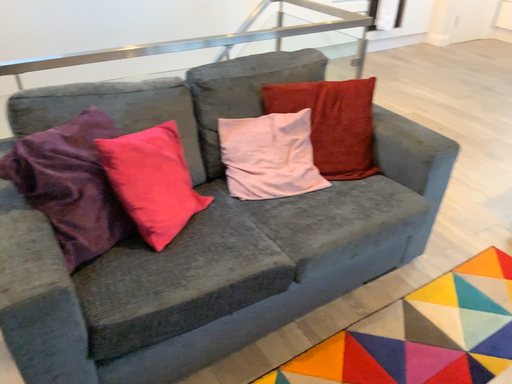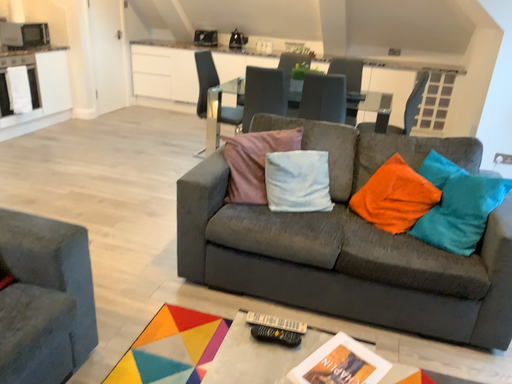
Question: How did the camera likely rotate when shooting the video?

Choices:
 (A) rotated upward
 (B) rotated downward

Answer: (A)